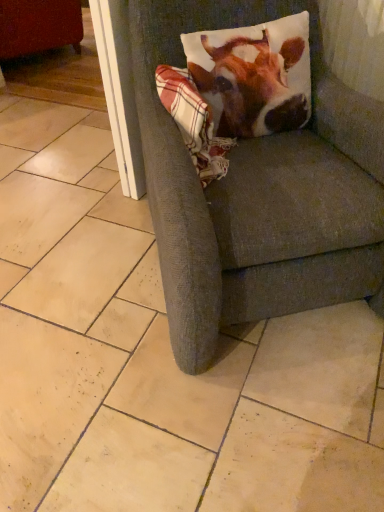
Question: Can you confirm if printed fabric pillow at upper right is smaller than white glossy screen door at upper left?

Choices:
 (A) no
 (B) yes

Answer: (B)

Question: Is printed fabric pillow at upper right positioned beyond the bounds of white glossy screen door at upper left?

Choices:
 (A) no
 (B) yes

Answer: (B)

Question: From the image's perspective, is printed fabric pillow at upper right below white glossy screen door at upper left?

Choices:
 (A) no
 (B) yes

Answer: (B)

Question: From a real-world perspective, does printed fabric pillow at upper right stand above white glossy screen door at upper left?

Choices:
 (A) no
 (B) yes

Answer: (B)

Question: Is printed fabric pillow at upper right further to the viewer compared to white glossy screen door at upper left?

Choices:
 (A) yes
 (B) no

Answer: (B)

Question: Considering the relative sizes of printed fabric pillow at upper right and white glossy screen door at upper left in the image provided, is printed fabric pillow at upper right wider than white glossy screen door at upper left?

Choices:
 (A) yes
 (B) no

Answer: (B)

Question: Does printed fabric pillow at upper right contain matte red swivel chair at upper left?

Choices:
 (A) no
 (B) yes

Answer: (A)

Question: Could you tell me if printed fabric pillow at upper right is facing matte red swivel chair at upper left?

Choices:
 (A) yes
 (B) no

Answer: (B)

Question: Is printed fabric pillow at upper right directly adjacent to matte red swivel chair at upper left?

Choices:
 (A) yes
 (B) no

Answer: (B)

Question: From a real-world perspective, is printed fabric pillow at upper right on matte red swivel chair at upper left?

Choices:
 (A) yes
 (B) no

Answer: (A)

Question: From the image's perspective, is printed fabric pillow at upper right located above matte red swivel chair at upper left?

Choices:
 (A) yes
 (B) no

Answer: (B)

Question: Can you confirm if printed fabric pillow at upper right is positioned to the right of matte red swivel chair at upper left?

Choices:
 (A) yes
 (B) no

Answer: (A)

Question: Can plaid fabric at upper right be found inside matte red swivel chair at upper left?

Choices:
 (A) yes
 (B) no

Answer: (B)